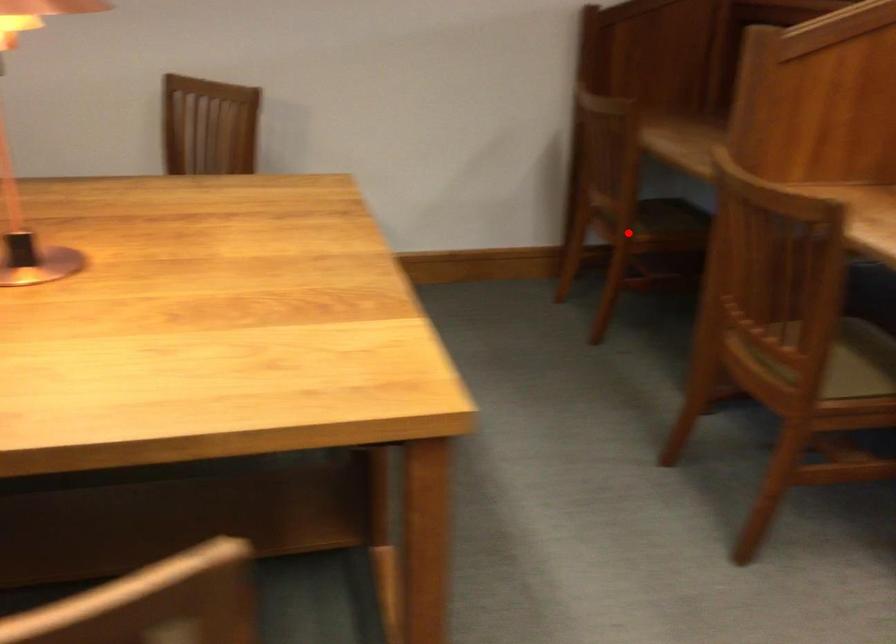
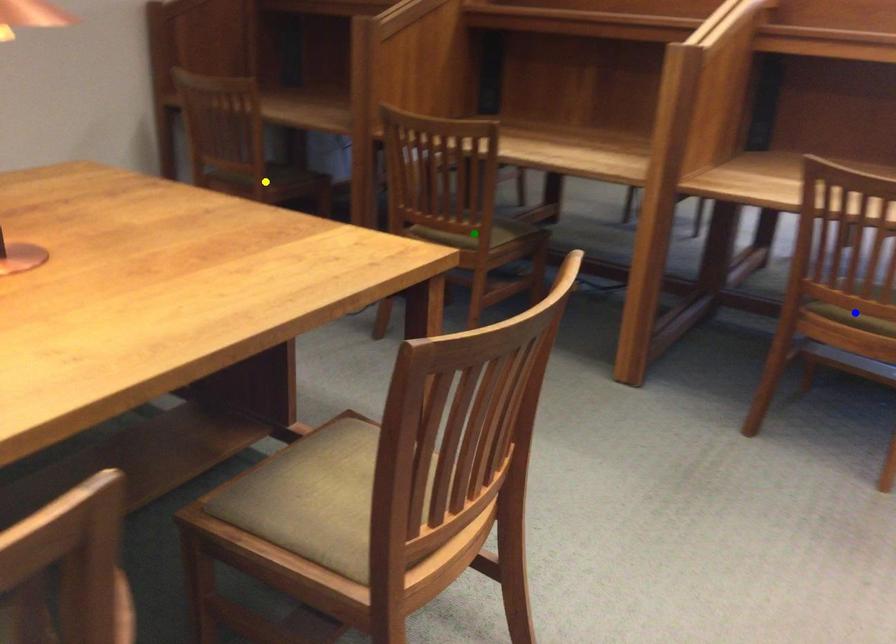
Question: I am providing you with two images of the same scene from different viewpoints. A red point is marked on the first image. You are given multiple points on the second image. In image 2, which mark is for the same physical point as the one in image 1?

Choices:
 (A) blue point
 (B) yellow point
 (C) green point

Answer: (B)